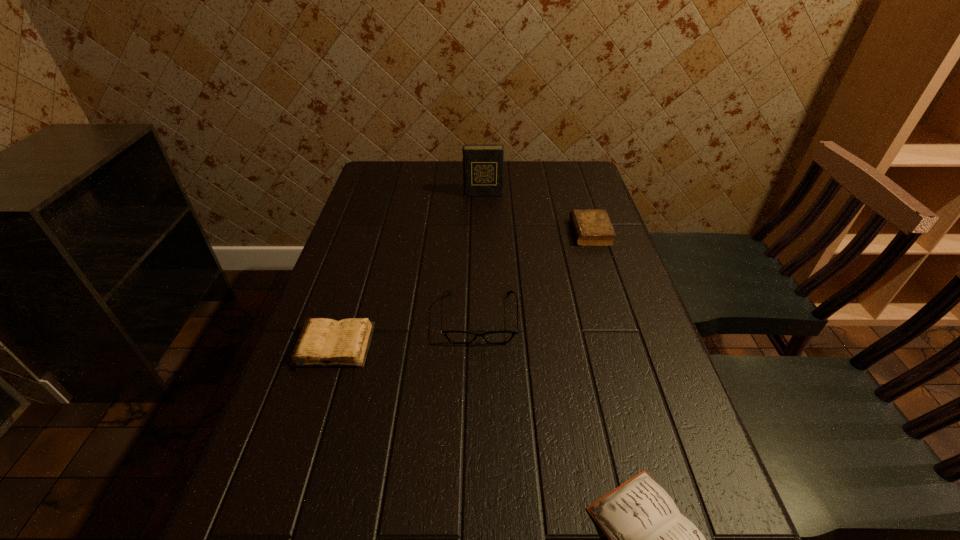
Where is `free space located 0.170m on the spine side of the third nearest diary`? This screenshot has height=540, width=960. free space located 0.170m on the spine side of the third nearest diary is located at coordinates (514, 232).

Find the location of `vacant region located 0.080m on the spine side of the third nearest diary`. vacant region located 0.080m on the spine side of the third nearest diary is located at coordinates (544, 232).

Identify the location of vacant space situated 0.160m on the back of the fourth tallest object. Image resolution: width=960 pixels, height=540 pixels. (356, 278).

This screenshot has width=960, height=540. What are the coordinates of `object that is at the far edge` in the screenshot? It's located at (482, 164).

Where is `object that is at the left edge`? This screenshot has height=540, width=960. object that is at the left edge is located at coordinates (324, 342).

Where is `object present at the right edge`? Image resolution: width=960 pixels, height=540 pixels. object present at the right edge is located at coordinates (592, 227).

In the image, there is a desktop. Where is `vacant space at the far edge`? The height and width of the screenshot is (540, 960). vacant space at the far edge is located at coordinates (516, 178).

At what (x,y) coordinates should I click in order to perform the action: click on free space at the left edge. Please return your answer as a coordinate pair (x, y). This screenshot has width=960, height=540. Looking at the image, I should click on (260, 443).

This screenshot has width=960, height=540. Identify the location of vacant space at the right edge of the desktop. (567, 262).

In the image, there is a desktop. In order to click on vacant space at the far left corner in this screenshot , I will do [x=368, y=182].